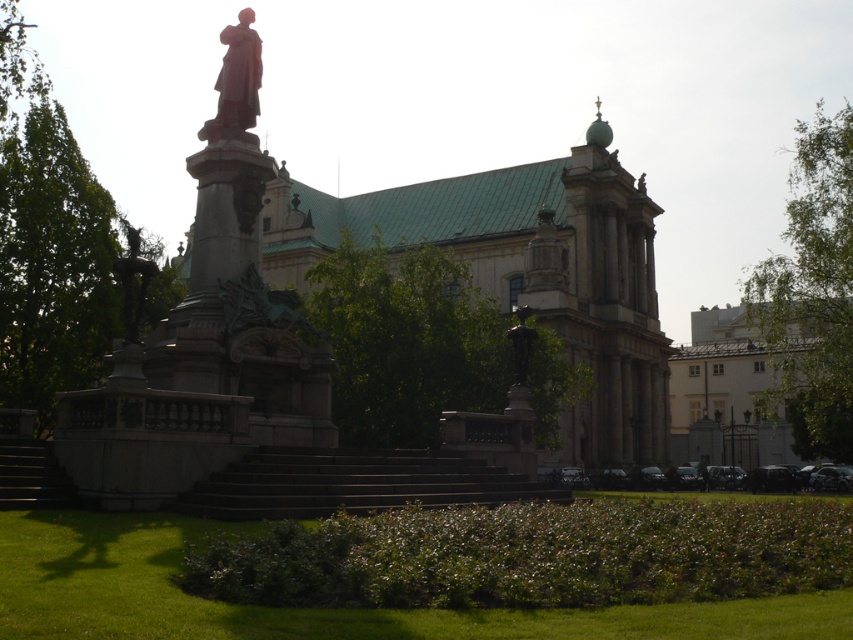
You are standing in the park and want to take a photo of both the statue and the historic building. You notice two points marked on your map at coordinates point (790, 212) and point (222, 84). Which point should you stand at to ensure both the statue and the building are in the same frame?

You should stand at point (222, 84) because it is closer to the viewer, allowing both the statue and the building to be captured in the same frame.